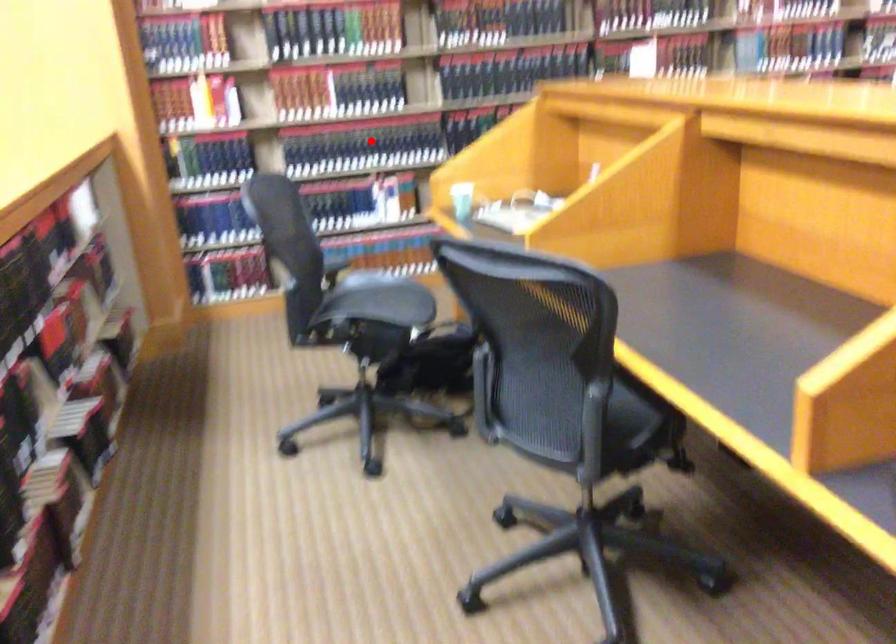
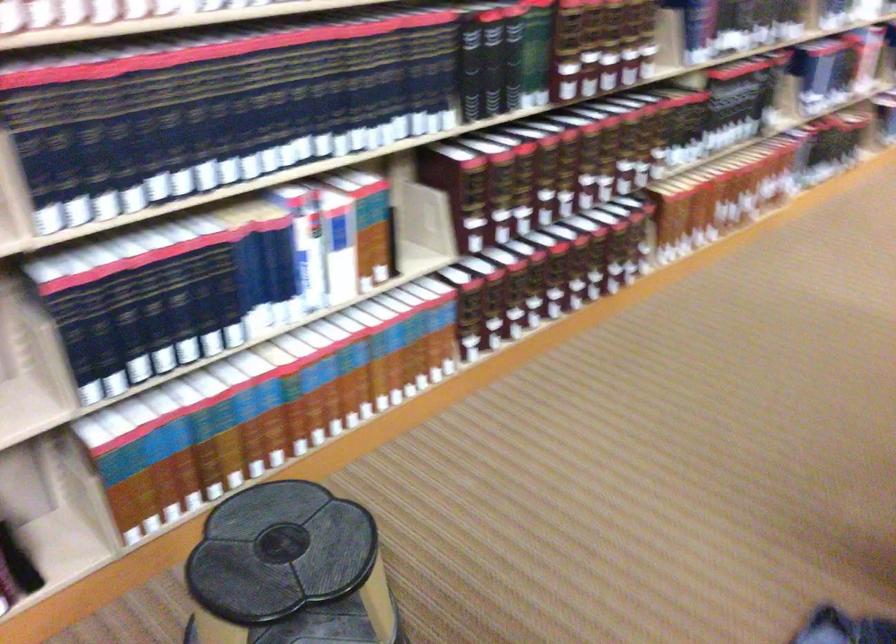
Question: I am providing you with two images of the same scene from different viewpoints. A red point is shown in image1. For the corresponding object point in image2, is it positioned nearer or farther from the camera?

Choices:
 (A) Nearer
 (B) Farther

Answer: (A)